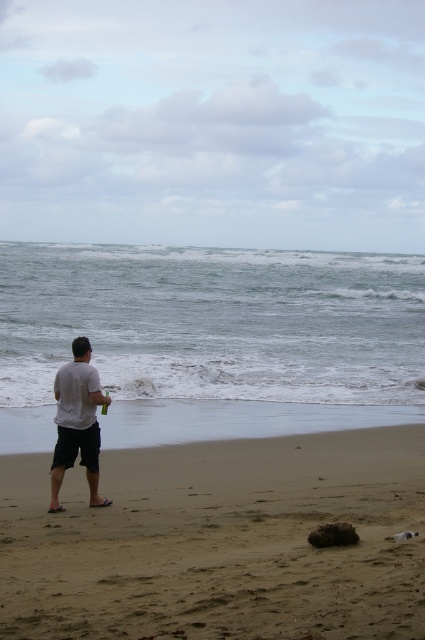
Question: Does sandy at left have a larger size compared to white matte shirt at center?

Choices:
 (A) no
 (B) yes

Answer: (A)

Question: Which point is farther to the camera?

Choices:
 (A) (88, 372)
 (B) (396, 605)

Answer: (A)

Question: Which object is farther from the camera taking this photo?

Choices:
 (A) sandy at left
 (B) white matte shirt at center

Answer: (B)

Question: Is sandy at left above white matte shirt at center?

Choices:
 (A) no
 (B) yes

Answer: (A)

Question: Does sandy at left come in front of white matte shirt at center?

Choices:
 (A) yes
 (B) no

Answer: (A)